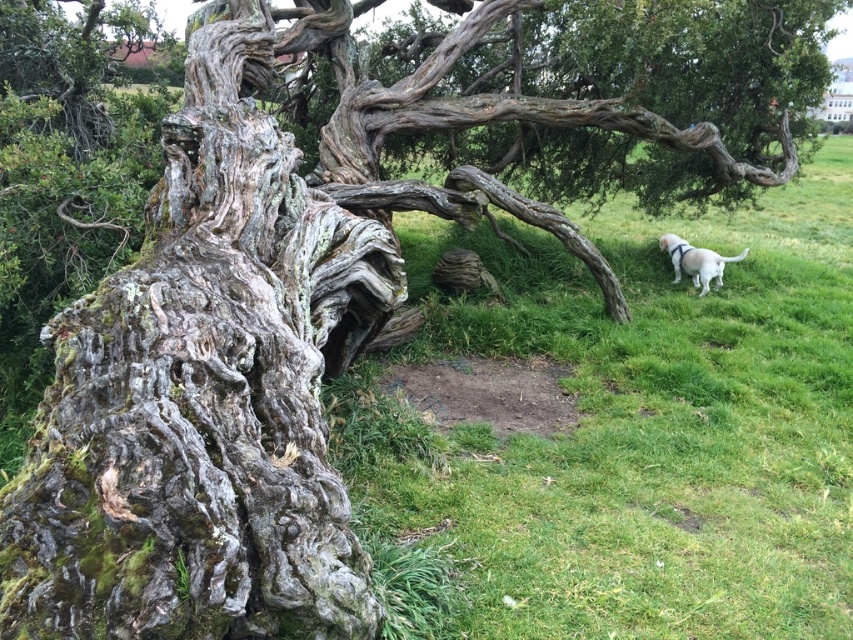
Which is above, gray rough bark tree trunk at left or white matte dog at right?

white matte dog at right is higher up.

You are a GUI agent. You are given a task and a screenshot of the screen. Output one action in this format:
    pyautogui.click(x=<x>, y=<y>)
    Task: Click on the gray rough bark tree trunk at left
    This screenshot has height=640, width=853.
    Given the screenshot: What is the action you would take?
    pyautogui.click(x=206, y=387)

This screenshot has height=640, width=853. In order to click on gray rough bark tree trunk at left in this screenshot , I will do `click(206, 387)`.

Who is more forward, (799, 378) or (207, 152)?

Point (207, 152) is more forward.

Who is positioned more to the right, green grassy at center or gray rough bark tree trunk at left?

Positioned to the right is green grassy at center.

Between point (612, 397) and point (82, 369), which one is positioned in front?

Point (82, 369)

Where is `green grassy at center`? green grassy at center is located at coordinates (657, 426).

Is green grassy at center taller than white matte dog at right?

Incorrect, green grassy at center's height is not larger of white matte dog at right's.

Does point (575, 403) lie in front of point (722, 257)?

Yes, point (575, 403) is in front of point (722, 257).

Locate an element on the screen. The height and width of the screenshot is (640, 853). green grassy at center is located at coordinates (657, 426).